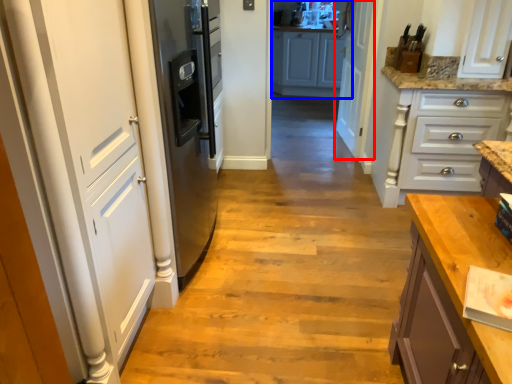
Question: Which object is closer to the camera taking this photo, door (highlighted by a red box) or cabinetry (highlighted by a blue box)?

Choices:
 (A) door
 (B) cabinetry

Answer: (A)